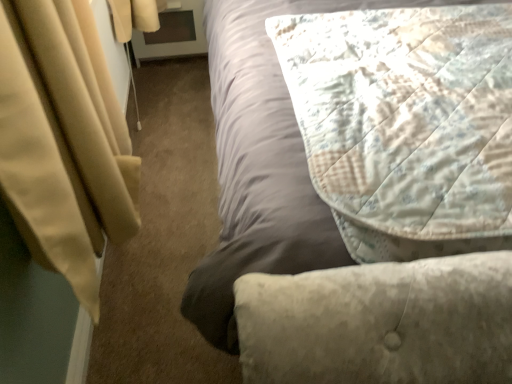
This screenshot has width=512, height=384. What are the coordinates of `quilted fabric pillow at upper right` in the screenshot? It's located at (406, 115).

Measure the distance between quilted fabric pillow at upper right and camera.

quilted fabric pillow at upper right is 27.78 inches away from camera.

The height and width of the screenshot is (384, 512). What do you see at coordinates (406, 115) in the screenshot?
I see `quilted fabric pillow at upper right` at bounding box center [406, 115].

What do you see at coordinates (323, 249) in the screenshot?
I see `quilted fabric bed at center` at bounding box center [323, 249].

Where is `quilted fabric bed at center`? The image size is (512, 384). quilted fabric bed at center is located at coordinates (323, 249).

Identify the location of quilted fabric pillow at upper right. (406, 115).

Does quilted fabric pillow at upper right appear on the left side of quilted fabric bed at center?

Yes.

Is quilted fabric pillow at upper right in front of quilted fabric bed at center?

No, it is behind quilted fabric bed at center.

Which is further, (405,59) or (256,167)?

The point (405,59) is more distant.

From the image's perspective, which one is positioned higher, quilted fabric pillow at upper right or quilted fabric bed at center?

From the image's view, quilted fabric bed at center is above.

From a real-world perspective, is quilted fabric pillow at upper right under quilted fabric bed at center?

Incorrect, from a real-world perspective, quilted fabric pillow at upper right is higher than quilted fabric bed at center.

Which object is wider, quilted fabric pillow at upper right or quilted fabric bed at center?

Wider between the two is quilted fabric bed at center.

From their relative heights in the image, would you say quilted fabric pillow at upper right is taller or shorter than quilted fabric bed at center?

In the image, quilted fabric pillow at upper right appears to be shorter than quilted fabric bed at center.

Based on their sizes in the image, would you say quilted fabric pillow at upper right is bigger or smaller than quilted fabric bed at center?

In the image, quilted fabric pillow at upper right appears to be smaller than quilted fabric bed at center.

Choose the correct answer: Is quilted fabric pillow at upper right inside quilted fabric bed at center or outside it?

quilted fabric pillow at upper right is spatially positioned inside quilted fabric bed at center.

Is quilted fabric pillow at upper right far away from quilted fabric bed at center?

Actually, quilted fabric pillow at upper right and quilted fabric bed at center are a little close together.

Is quilted fabric pillow at upper right facing towards quilted fabric bed at center?

Yes, quilted fabric pillow at upper right is facing quilted fabric bed at center.

How many degrees apart are the facing directions of quilted fabric pillow at upper right and quilted fabric bed at center?

There is a 0.000109-degree angle between the facing directions of quilted fabric pillow at upper right and quilted fabric bed at center.

Image resolution: width=512 pixels, height=384 pixels. I want to click on pillow lying behind the quilted fabric bed at center, so click(x=406, y=115).

Which object is positioned more to the right, quilted fabric bed at center or quilted fabric pillow at upper right?

quilted fabric bed at center.

Which is behind, quilted fabric bed at center or quilted fabric pillow at upper right?

quilted fabric pillow at upper right.

In the scene shown: Which is farther from the camera, (278, 12) or (300, 68)?

The point (278, 12) is farther.

From the image's perspective, is quilted fabric bed at center positioned above or below quilted fabric pillow at upper right?

Clearly, from the image's perspective, quilted fabric bed at center is above quilted fabric pillow at upper right.

Consider the image. From a real-world perspective, between quilted fabric bed at center and quilted fabric pillow at upper right, who is vertically higher?

quilted fabric pillow at upper right is physically above.

Is quilted fabric bed at center wider than quilted fabric pillow at upper right?

Yes, quilted fabric bed at center is wider than quilted fabric pillow at upper right.

Consider the image. Considering the sizes of quilted fabric bed at center and quilted fabric pillow at upper right in the image, is quilted fabric bed at center taller or shorter than quilted fabric pillow at upper right?

Considering their sizes, quilted fabric bed at center has more height than quilted fabric pillow at upper right.

Considering the relative sizes of quilted fabric bed at center and quilted fabric pillow at upper right in the image provided, is quilted fabric bed at center bigger than quilted fabric pillow at upper right?

Indeed, quilted fabric bed at center has a larger size compared to quilted fabric pillow at upper right.

Is quilted fabric bed at center outside of quilted fabric pillow at upper right?

Yes, quilted fabric bed at center is outside of quilted fabric pillow at upper right.

From the picture: Is quilted fabric bed at center positioned far away from quilted fabric pillow at upper right?

Actually, quilted fabric bed at center and quilted fabric pillow at upper right are a little close together.

Is quilted fabric bed at center facing away from quilted fabric pillow at upper right?

No.

Can you tell me how much quilted fabric bed at center and quilted fabric pillow at upper right differ in facing direction?

0.000109 degrees separate the facing orientations of quilted fabric bed at center and quilted fabric pillow at upper right.

Find the location of a particular element. Image resolution: width=512 pixels, height=384 pixels. pillow on the left side of quilted fabric bed at center is located at coordinates (406, 115).

In order to click on bed above the quilted fabric pillow at upper right (from the image's perspective) in this screenshot , I will do `click(323, 249)`.

Locate an element on the screen. This screenshot has height=384, width=512. pillow that is on the left side of quilted fabric bed at center is located at coordinates (406, 115).